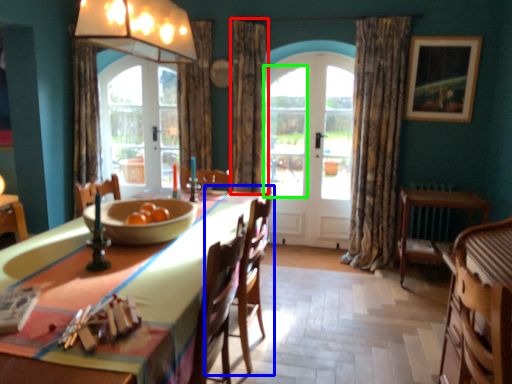
Question: Which is nearer to the curtain (highlighted by a red box)? chair (highlighted by a blue box) or window (highlighted by a green box).

Choices:
 (A) chair
 (B) window

Answer: (B)